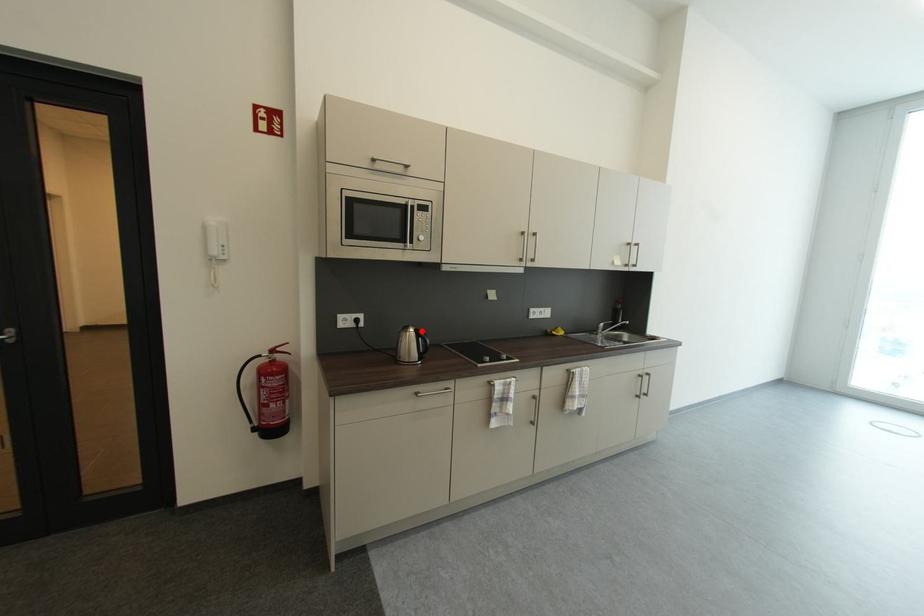
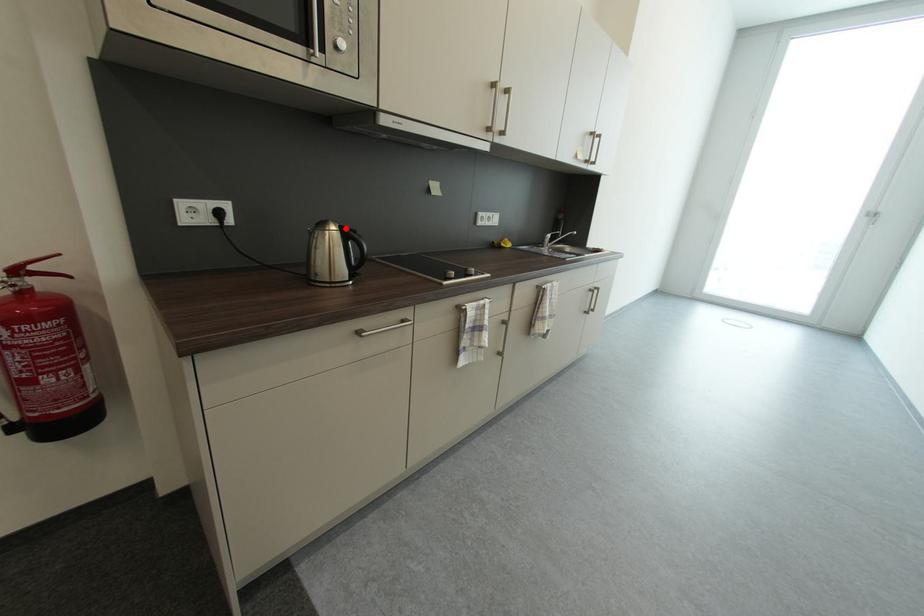
I am providing you with two images of the same scene from different viewpoints. A red point is marked on the first image and another point is marked on the second image. Are the points marked in image1 and image2 representing the same 3D position?

Yes